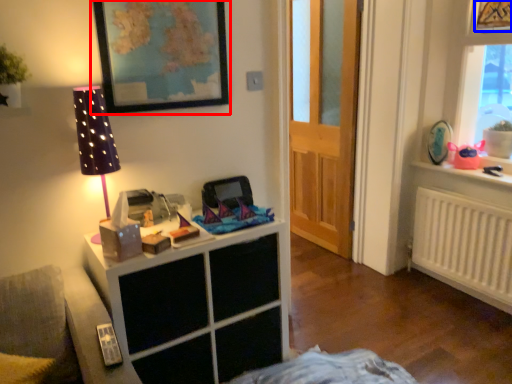
Question: Among these objects, which one is farthest to the camera, picture frame (highlighted by a red box) or picture frame (highlighted by a blue box)?

Choices:
 (A) picture frame
 (B) picture frame

Answer: (B)